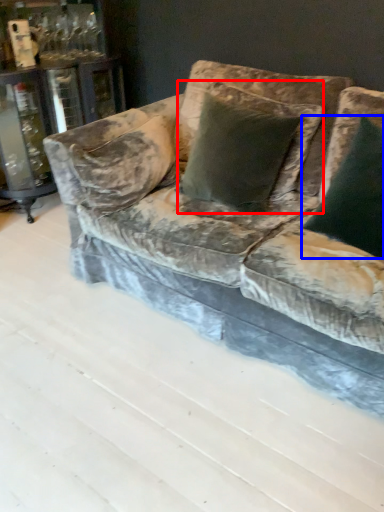
Question: Among these objects, which one is nearest to the camera, pillow (highlighted by a red box) or pillow (highlighted by a blue box)?

Choices:
 (A) pillow
 (B) pillow

Answer: (B)